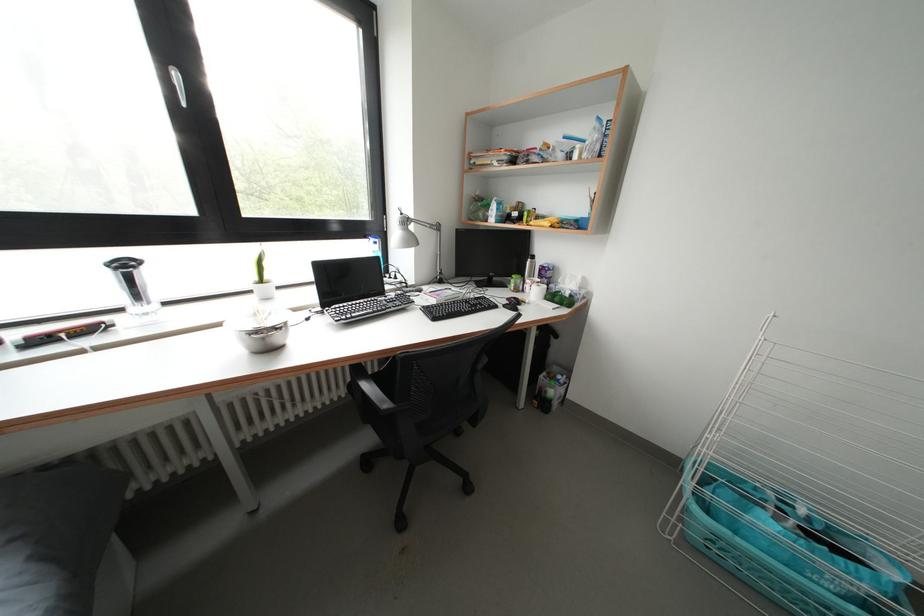
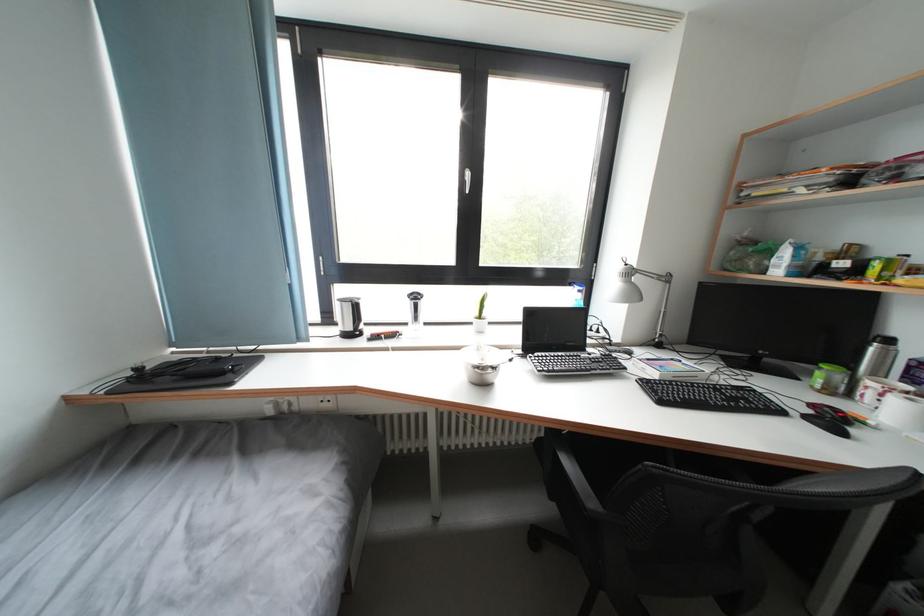
Where in the second image is the point corresponding to (179,78) from the first image?

(473, 177)